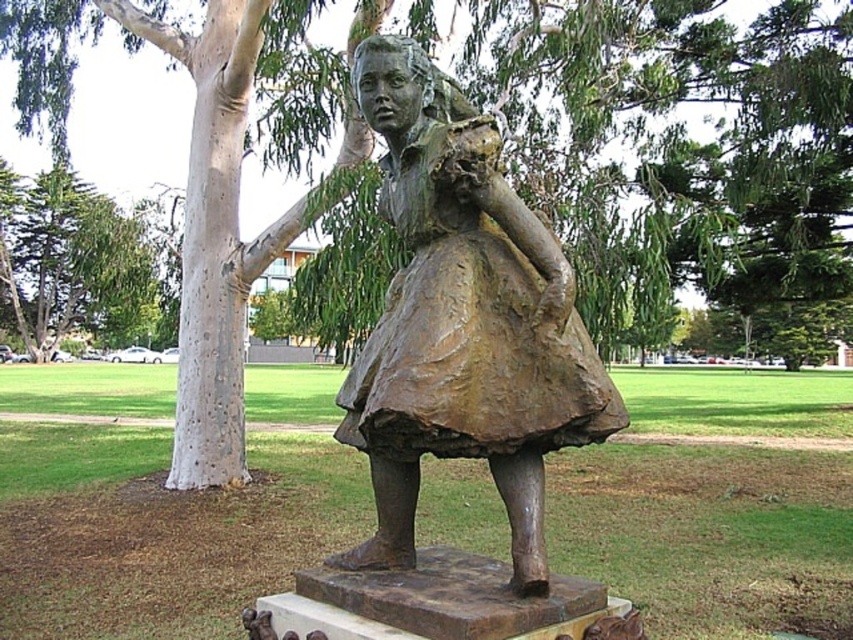
You are an artist planning to sketch the bronze statue at center and the green leafy tree at left. Based on their sizes, which object should you draw first if you want to place the larger one on the right side of your paper?

The green leafy tree at left is wider than the bronze statue at center, so you should draw the green leafy tree at left first on the right side of your paper to accommodate its larger size.

You are standing in the park and want to take a photo of the bronze statue at center. To ensure the statue is centered in your photo, where should you position yourself relative to the statue?

Since the bronze statue at center is located at point (462, 324), you should position yourself directly in front of it, ensuring that the statue is centered horizontally and vertically within your camera frame.